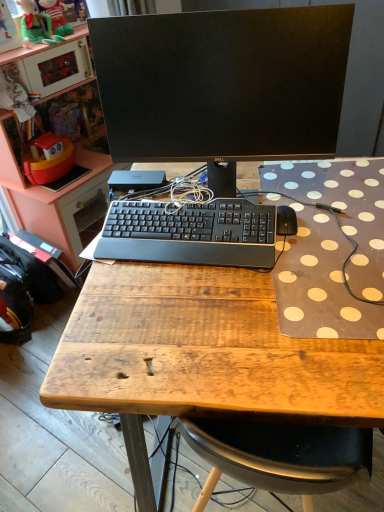
The image size is (384, 512). What are the coordinates of `vacant space to the right of black matte monitor at center` in the screenshot? It's located at (319, 194).